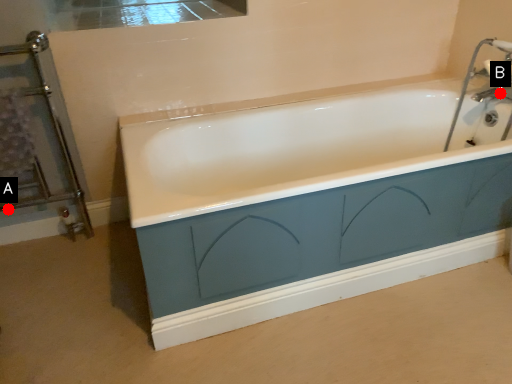
Question: Two points are circled on the image, labeled by A and B beside each circle. Which of the following is the closest to the observer?

Choices:
 (A) A is closer
 (B) B is closer

Answer: (A)